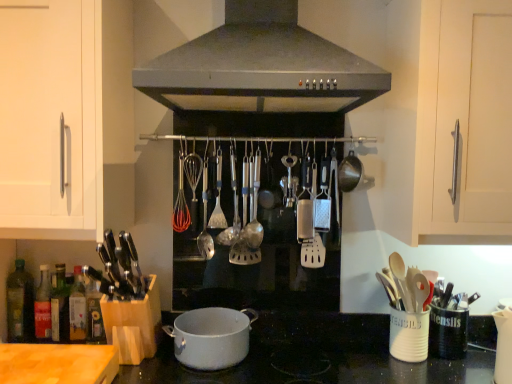
Question: From their relative heights in the image, would you say wooden cutting board at lower left is taller or shorter than silver metallic spoon at center, which appears as the first utensil when viewed from the left?

Choices:
 (A) tall
 (B) short

Answer: (B)

Question: From a real-world perspective, is wooden cutting board at lower left above or below silver metallic spoon at center, which appears as the first utensil when viewed from the left?

Choices:
 (A) below
 (B) above

Answer: (A)

Question: Which object is the closest to the satin silver spoon at center, which appears as the 2th utensil when viewed from the right?

Choices:
 (A) satin steel range hood at center
 (B) silver metallic spoon at center, which appears as the first utensil when viewed from the left
 (C) wooden cutting board at lower left
 (D) white matte pot at center
 (E) satin silver spoon at center, acting as the first utensil starting from the right

Answer: (E)

Question: Considering the real-world distances, which object is farthest from the satin silver spoon at center, acting as the first utensil starting from the right?

Choices:
 (A) satin silver spoon at center, which appears as the 2th utensil when viewed from the right
 (B) wooden spoons at right
 (C) satin steel range hood at center
 (D) green glass bottle at lower left
 (E) white matte cabinet handle at upper left

Answer: (D)